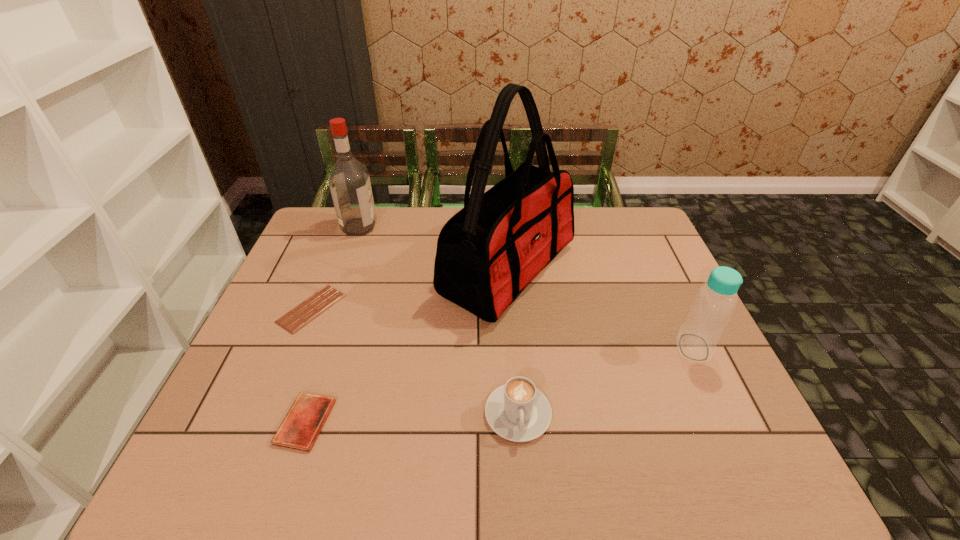
Where is `unoccupied position between the third shortest object and the duffel bag`? This screenshot has width=960, height=540. unoccupied position between the third shortest object and the duffel bag is located at coordinates (513, 341).

Where is `free space between the bottle and the diary`? This screenshot has height=540, width=960. free space between the bottle and the diary is located at coordinates (500, 384).

The height and width of the screenshot is (540, 960). I want to click on vacant space that is in between the diary and the duffel bag, so click(407, 346).

The image size is (960, 540). Find the location of `free space between the rightmost object and the third shortest object`. free space between the rightmost object and the third shortest object is located at coordinates (606, 380).

Where is `empty space that is in between the diary and the rightmost object`? empty space that is in between the diary and the rightmost object is located at coordinates (500, 384).

Locate an element on the screen. blank region between the chocolate bar and the bottle is located at coordinates (502, 328).

Image resolution: width=960 pixels, height=540 pixels. In order to click on free space between the chocolate bar and the second tallest object in this screenshot , I will do `click(335, 267)`.

This screenshot has width=960, height=540. I want to click on blank region between the shortest object and the fifth shortest object, so tap(335, 267).

This screenshot has height=540, width=960. I want to click on vacant region between the cappuccino and the rightmost object, so click(606, 380).

Point out which object is positioned as the fifth nearest to the fourth shortest object. Please provide its 2D coordinates. Your answer should be formatted as a tuple, i.e. [(x, y)], where the tuple contains the x and y coordinates of a point satisfying the conditions above.

[(349, 181)]